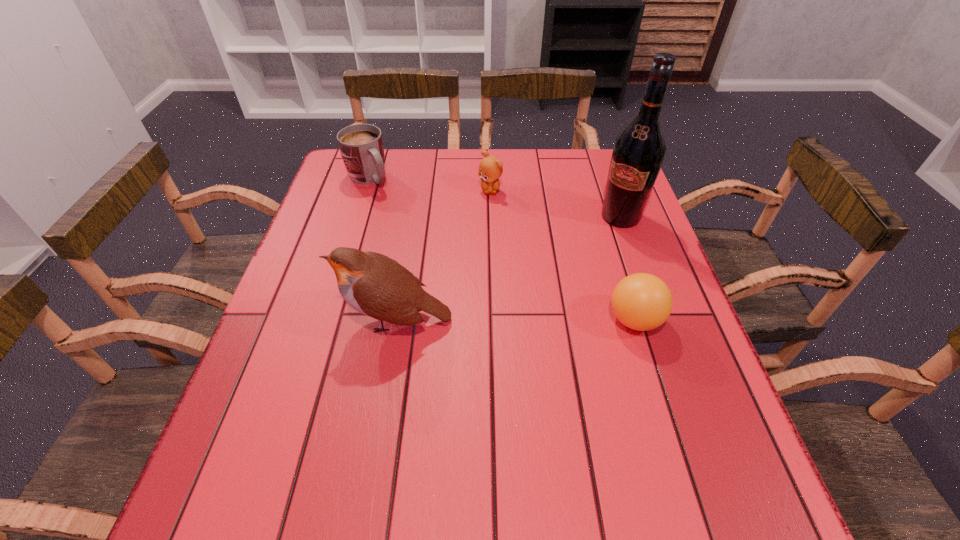
Find the location of a particular element. vacant space situated on the face of the third object from left to right is located at coordinates (490, 224).

This screenshot has width=960, height=540. I want to click on vacant area located on the side of the mug with the handle, so click(x=453, y=263).

Locate an element on the screen. This screenshot has width=960, height=540. free space located 0.080m on the side of the mug with the handle is located at coordinates (393, 204).

Image resolution: width=960 pixels, height=540 pixels. Find the location of `blank area located on the side of the mug with the handle`. blank area located on the side of the mug with the handle is located at coordinates (400, 211).

You are a GUI agent. You are given a task and a screenshot of the screen. Output one action in this format:
    pyautogui.click(x=<x>, y=<y>)
    Task: Click on the free space located 0.100m on the label of the tallest object
    
    Given the screenshot: What is the action you would take?
    pyautogui.click(x=596, y=249)

Where is `vacant space situated on the label of the tallest object`? The width and height of the screenshot is (960, 540). vacant space situated on the label of the tallest object is located at coordinates (574, 278).

I want to click on vacant area located 0.080m on the label of the tallest object, so 599,245.

Locate an element on the screen. Image resolution: width=960 pixels, height=540 pixels. teddy bear at the far edge is located at coordinates (490, 168).

Where is `mug present at the far edge`? The image size is (960, 540). mug present at the far edge is located at coordinates (361, 145).

Identify the location of bird situated at the left edge. The image size is (960, 540). (x=373, y=284).